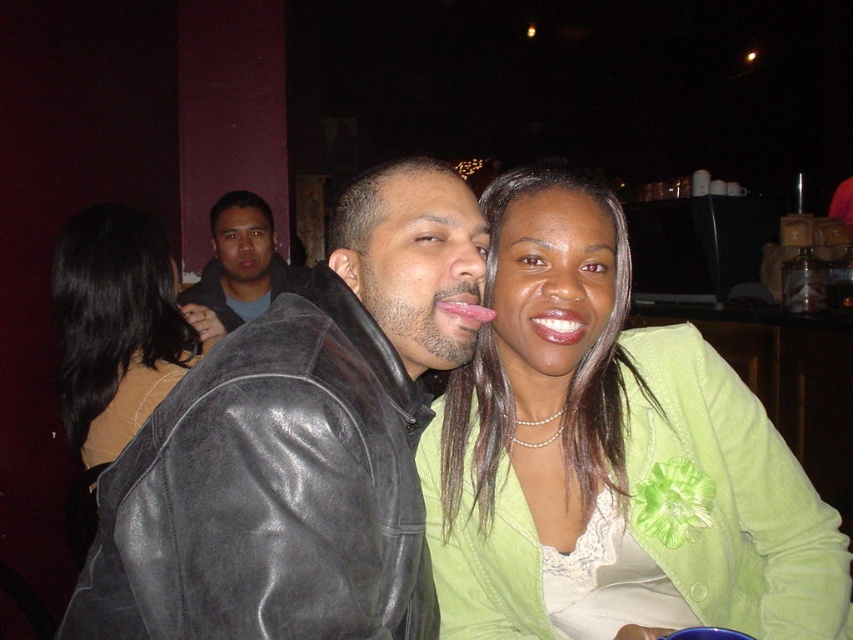
How much distance is there between green fabric jacket at center and matte pink lips at center?

green fabric jacket at center and matte pink lips at center are 8.37 inches apart.

Does green fabric jacket at center appear over matte pink lips at center?

Actually, green fabric jacket at center is below matte pink lips at center.

Which is behind, point (576, 417) or point (544, 310)?

The point (576, 417) is more distant.

The width and height of the screenshot is (853, 640). In order to click on green fabric jacket at center in this screenshot , I will do `click(610, 458)`.

Can you confirm if matte black jacket at left is thinner than matte black jacket at upper center?

Indeed, matte black jacket at left has a lesser width compared to matte black jacket at upper center.

Describe the element at coordinates (115, 326) in the screenshot. I see `matte black jacket at left` at that location.

Where is `matte black jacket at left`? matte black jacket at left is located at coordinates (115, 326).

Measure the distance between matte black jacket at upper center and glossy pink tongue at center.

7.66 feet

Between point (222, 307) and point (474, 312), which one is positioned behind?

The point (222, 307) is more distant.

Find the location of `matte black jacket at upper center`. matte black jacket at upper center is located at coordinates (236, 268).

The image size is (853, 640). Identify the location of matte black jacket at upper center. (236, 268).